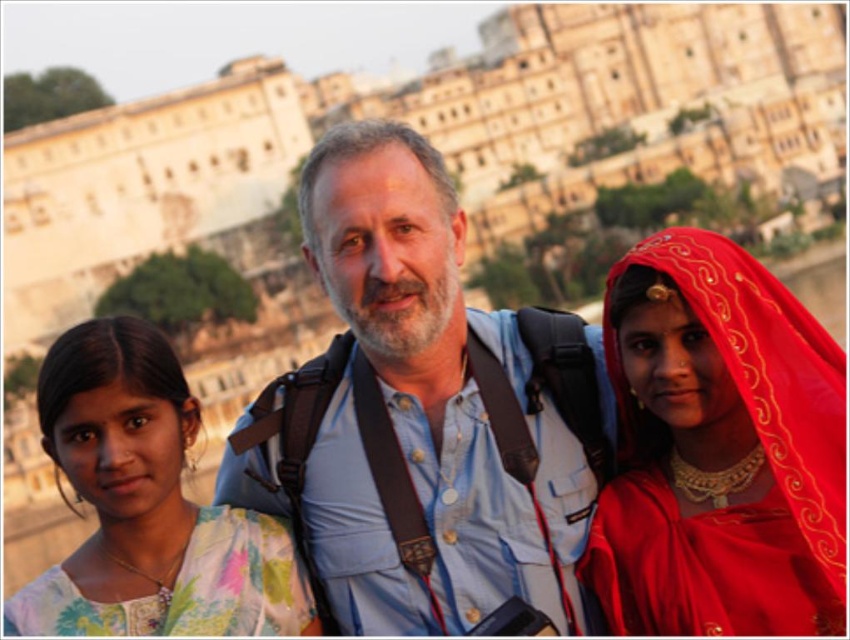
Who is positioned more to the left, blue denim shirt at center or matte red sari at center?

blue denim shirt at center

Is point (452, 561) less distant than point (687, 584)?

No, (452, 561) is further to viewer.

You are a GUI agent. You are given a task and a screenshot of the screen. Output one action in this format:
    pyautogui.click(x=<x>, y=<y>)
    Task: Click on the blue denim shirt at center
    The image size is (850, 640).
    Given the screenshot: What is the action you would take?
    pyautogui.click(x=422, y=416)

Is the position of matte red sari at center more distant than that of floral fabric dress at left?

That is False.

Describe the element at coordinates (718, 449) in the screenshot. This screenshot has height=640, width=850. I see `matte red sari at center` at that location.

Is point (843, 552) positioned before point (163, 355)?

Yes, point (843, 552) is closer to viewer.

Find the location of `matte red sari at center`. matte red sari at center is located at coordinates (718, 449).

Measure the distance from blue denim shirt at center to floral fabric dress at left.

blue denim shirt at center and floral fabric dress at left are 29.51 feet apart.

Which is below, blue denim shirt at center or floral fabric dress at left?

floral fabric dress at left

What do you see at coordinates (422, 416) in the screenshot? The height and width of the screenshot is (640, 850). I see `blue denim shirt at center` at bounding box center [422, 416].

Find the location of `blue denim shirt at center`. blue denim shirt at center is located at coordinates (422, 416).